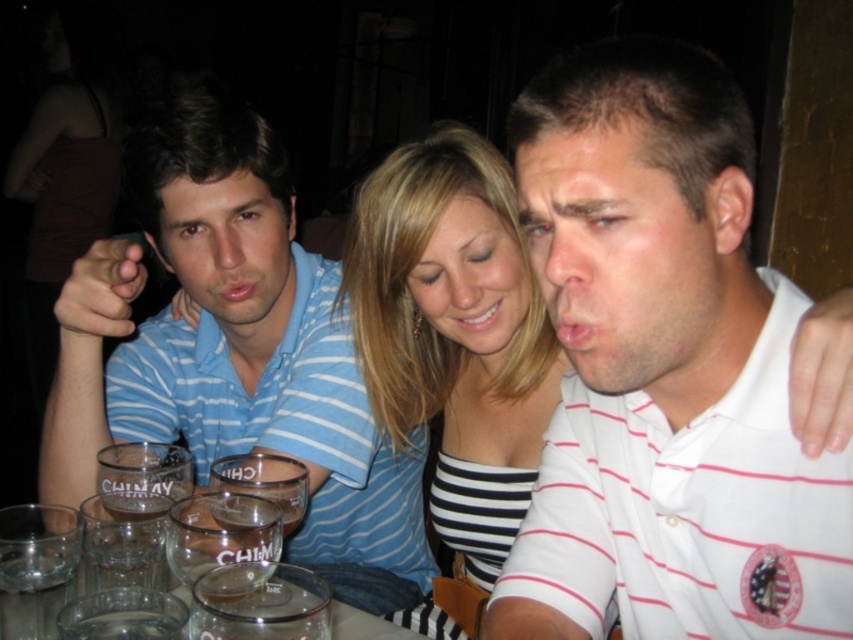
Question: Can you confirm if white striped polo shirt at right is bigger than transparent glass at lower left?

Choices:
 (A) yes
 (B) no

Answer: (A)

Question: Which is nearer to the blue striped polo shirt at left?

Choices:
 (A) transparent glass at lower left
 (B) clear glass shot glass at lower center
 (C) white striped polo shirt at right

Answer: (A)

Question: Can you confirm if white striped polo shirt at right is positioned below clear glass shot glass at lower center?

Choices:
 (A) yes
 (B) no

Answer: (B)

Question: Which object appears farthest from the camera in this image?

Choices:
 (A) clear glass shot glass at lower center
 (B) white striped polo shirt at right

Answer: (A)

Question: Can you confirm if blue striped polo shirt at left is positioned to the right of transparent glass at lower left?

Choices:
 (A) no
 (B) yes

Answer: (B)

Question: Estimate the real-world distances between objects in this image. Which object is farther from the white striped polo shirt at right?

Choices:
 (A) blue striped polo shirt at left
 (B) clear glass shot glass at lower center
 (C) transparent glass at lower left

Answer: (A)